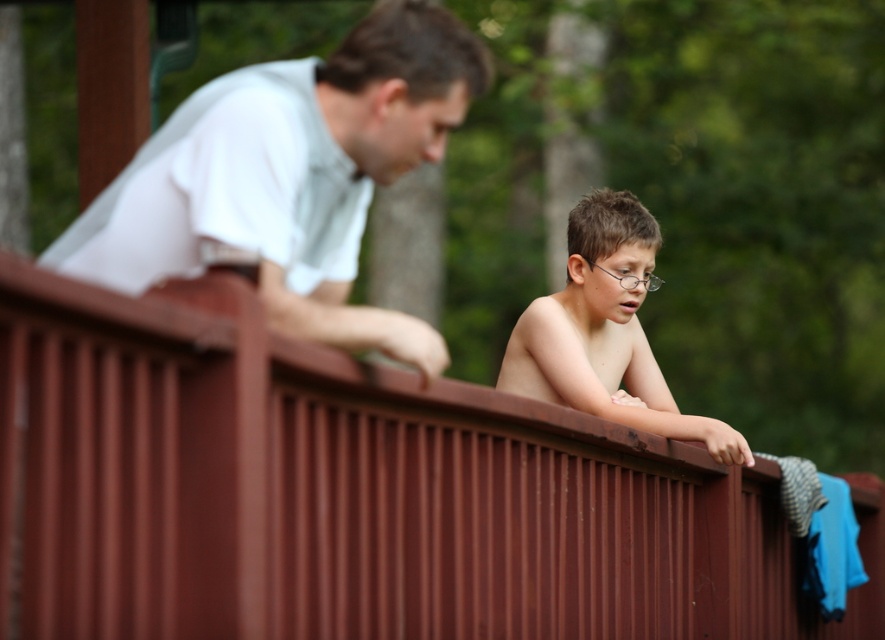
Is white matte shirt at upper left thinner than shiny brown hair at center?

Incorrect, white matte shirt at upper left's width is not less than shiny brown hair at center's.

Is point (460, 65) behind point (563, 339)?

No, (460, 65) is in front of (563, 339).

Does point (150, 220) lie in front of point (591, 275)?

Yes, it is in front of point (591, 275).

Locate an element on the screen. white matte shirt at upper left is located at coordinates (290, 177).

Does brown textured fence at upper center appear on the right side of white matte shirt at upper left?

Yes, brown textured fence at upper center is to the right of white matte shirt at upper left.

I want to click on brown textured fence at upper center, so pos(354,493).

Is brown textured fence at upper center smaller than shiny brown hair at center?

Correct, brown textured fence at upper center occupies less space than shiny brown hair at center.

Is brown textured fence at upper center further to camera compared to shiny brown hair at center?

That is False.

Identify the location of brown textured fence at upper center. The height and width of the screenshot is (640, 885). (354, 493).